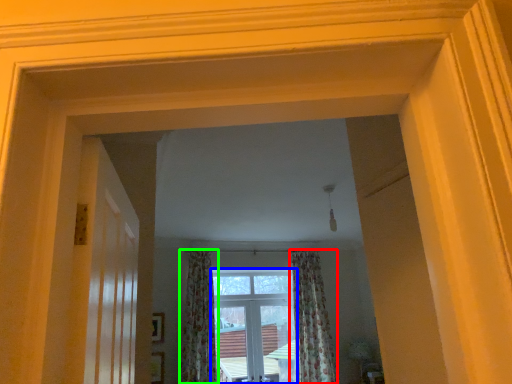
Question: Which object is the farthest from curtain (highlighted by a red box)? Choose among these: window (highlighted by a blue box) or curtain (highlighted by a green box).

Choices:
 (A) window
 (B) curtain

Answer: (B)